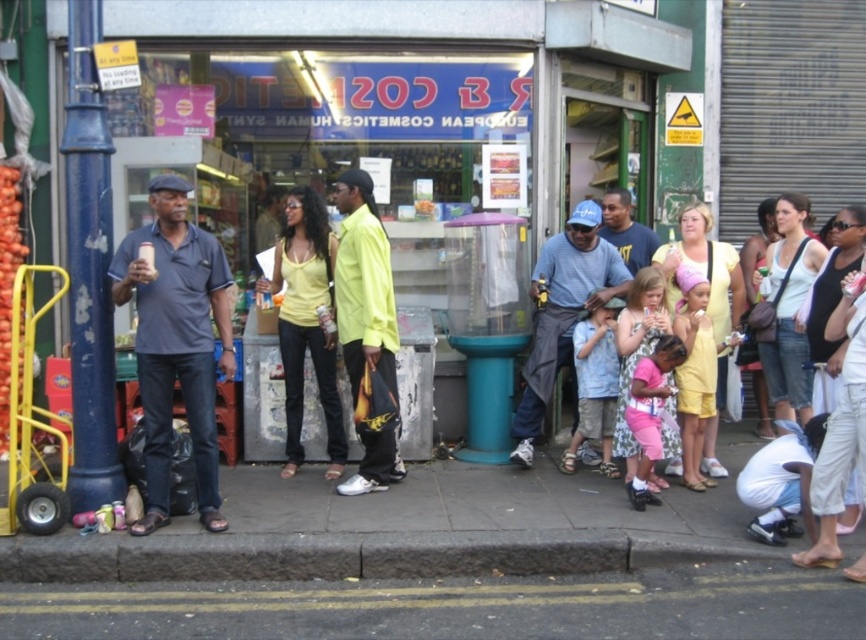
You are a customer standing in front of the European Cosmetics Human Synt shop. You see a dark blue shirt at left and a neon yellow shirt at center. Which one is nearer to you?

The dark blue shirt at left is closer to the viewer than the neon yellow shirt at center.

Where is the dark blue shirt at left located in the image?

The dark blue shirt at left is located at point (x=176, y=342) in the image.